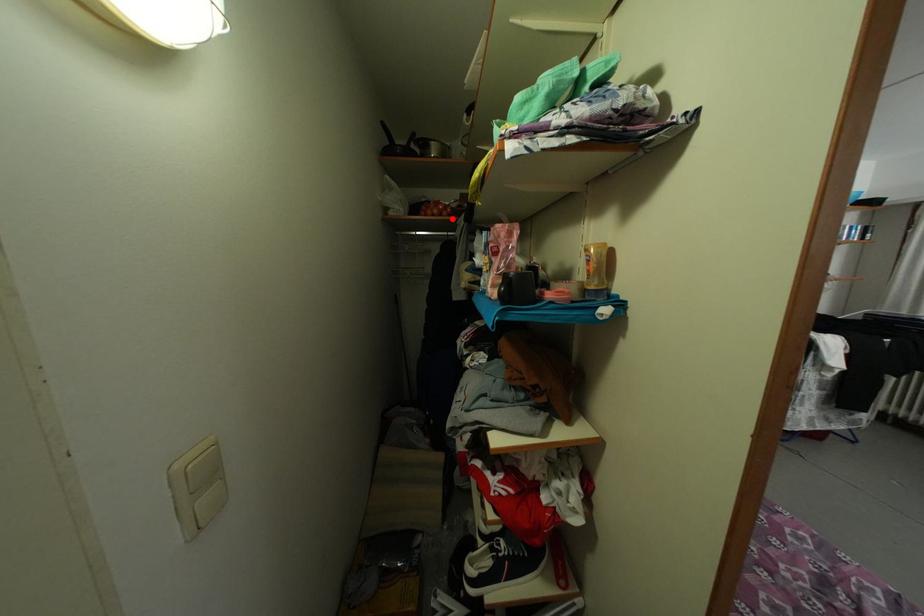
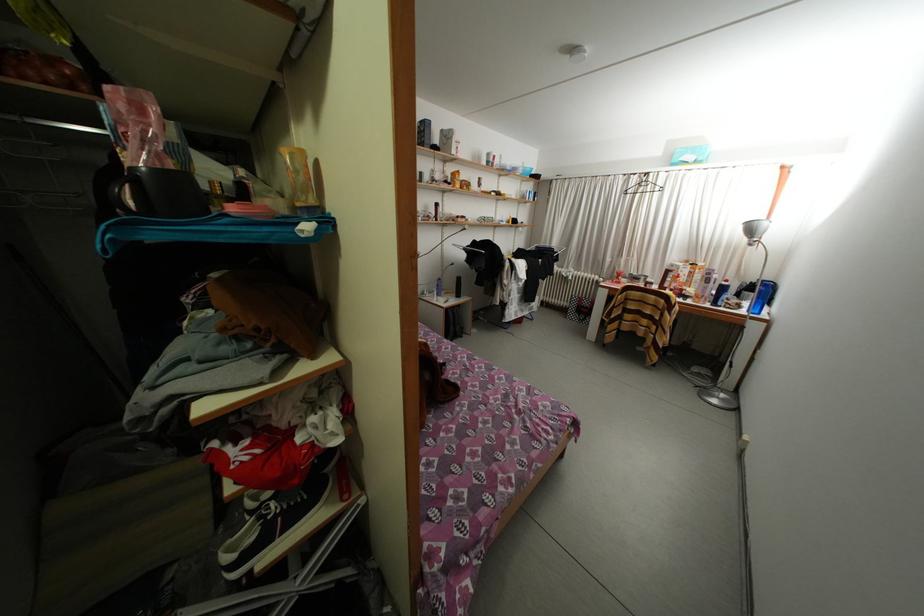
Where in the second image is the point corresponding to the highlighted location from the first image?

(91, 92)